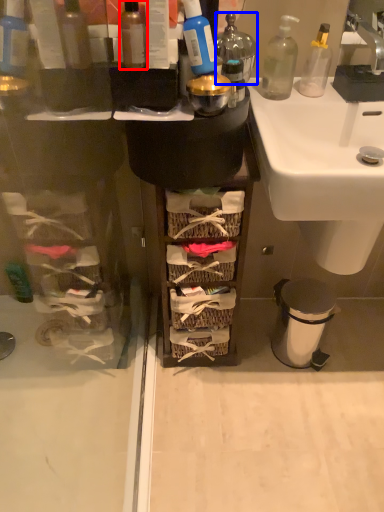
Question: Which point is closer to the camera, bottle (highlighted by a red box) or bottle (highlighted by a blue box)?

Choices:
 (A) bottle
 (B) bottle

Answer: (A)